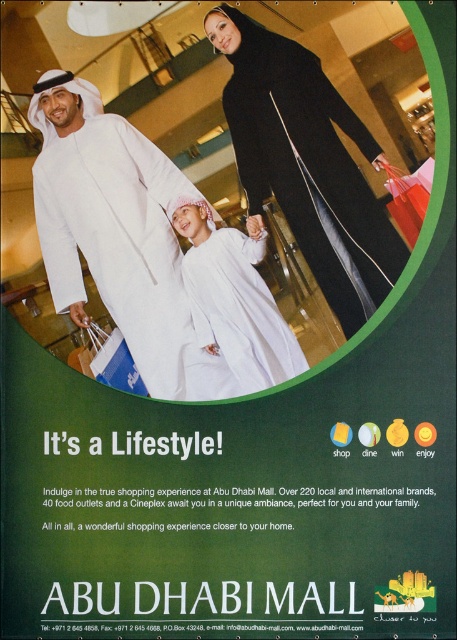
Question: Can you confirm if black matte abaya at center is smaller than white matte dress at center?

Choices:
 (A) no
 (B) yes

Answer: (A)

Question: Where is white matte abaya at center located in relation to white matte dress at center in the image?

Choices:
 (A) left
 (B) right

Answer: (A)

Question: Among these points, which one is farthest from the camera?

Choices:
 (A) (x=227, y=24)
 (B) (x=281, y=324)

Answer: (B)

Question: Does black matte abaya at center appear on the right side of white matte dress at center?

Choices:
 (A) no
 (B) yes

Answer: (B)

Question: Among these objects, which one is farthest from the camera?

Choices:
 (A) white matte abaya at center
 (B) white matte dress at center

Answer: (B)

Question: Which point is closer to the camera?

Choices:
 (A) white matte abaya at center
 (B) white matte dress at center
 (C) black matte abaya at center

Answer: (A)